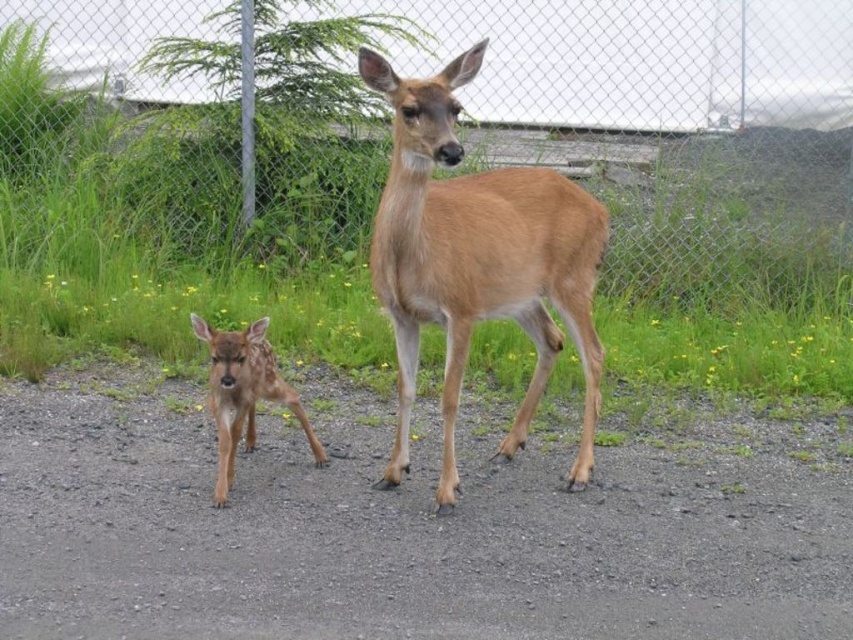
Question: Which of the following is the closest to the observer?

Choices:
 (A) spotted fur fawn at lower left
 (B) wire mesh fence at upper center
 (C) light brown fur at center

Answer: (C)

Question: Is wire mesh fence at upper center smaller than light brown fur at center?

Choices:
 (A) no
 (B) yes

Answer: (B)

Question: Which object is the closest to the light brown fur at center?

Choices:
 (A) spotted fur fawn at lower left
 (B) wire mesh fence at upper center

Answer: (A)

Question: From the image, what is the correct spatial relationship of light brown fur at center in relation to spotted fur fawn at lower left?

Choices:
 (A) below
 (B) above

Answer: (B)

Question: From the image, what is the correct spatial relationship of wire mesh fence at upper center in relation to spotted fur fawn at lower left?

Choices:
 (A) below
 (B) above

Answer: (B)

Question: Which object is farther from the camera taking this photo?

Choices:
 (A) light brown fur at center
 (B) spotted fur fawn at lower left
 (C) wire mesh fence at upper center

Answer: (C)